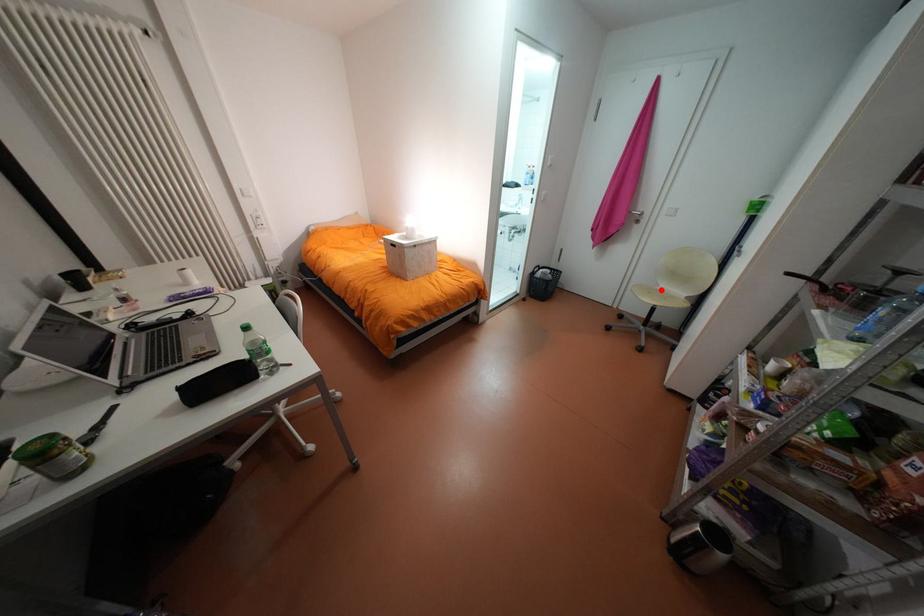
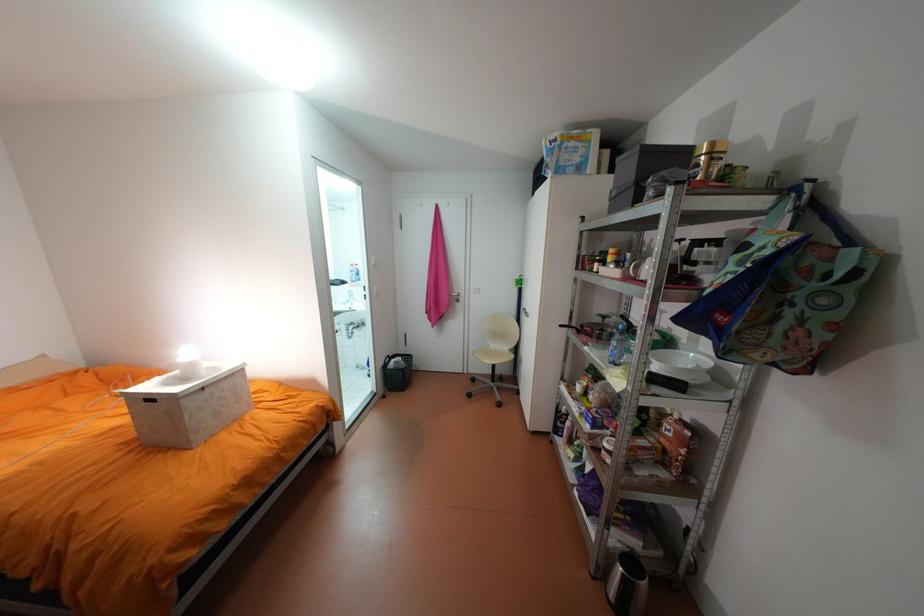
In the second image, find the point that corresponds to the highlighted location in the first image.

(497, 352)